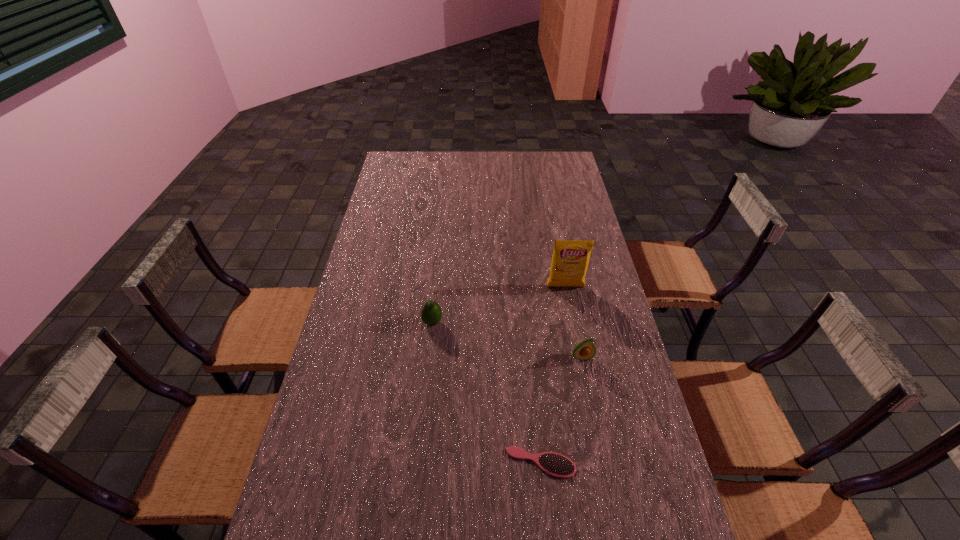
Find the location of a particular element. crisp (potato chip) is located at coordinates (570, 259).

I want to click on the tallest object, so point(570,259).

Locate an element on the screen. the leftmost object is located at coordinates (431, 314).

This screenshot has height=540, width=960. Identify the location of the left avocado. (431, 314).

Identify the location of the nearer avocado. (585, 350).

The height and width of the screenshot is (540, 960). Find the location of `the right avocado`. the right avocado is located at coordinates pos(585,350).

Locate an element on the screen. hairbrush is located at coordinates (554, 464).

Find the location of `the nearest object`. the nearest object is located at coordinates (554, 464).

Identify the location of vacant space located 0.220m on the front of the tallest object with the logo. This screenshot has height=540, width=960. (576, 342).

Locate an element on the screen. This screenshot has width=960, height=540. vacant space situated 0.160m on the front of the leftmost object is located at coordinates (427, 374).